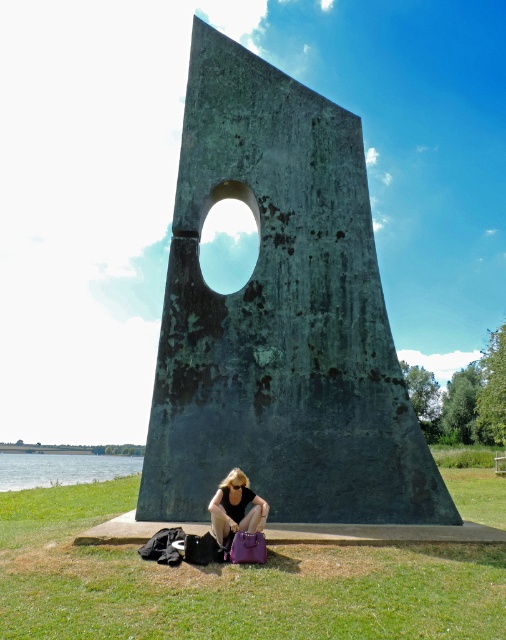
Does green patina stone sculpture at center appear over green water at lower left?

Indeed, green patina stone sculpture at center is positioned over green water at lower left.

Is green patina stone sculpture at center closer to camera compared to green water at lower left?

Yes, it is in front of green water at lower left.

Is point (331, 461) positioned after point (72, 456)?

No, it is in front of (72, 456).

Where is `green patina stone sculpture at center`? The width and height of the screenshot is (506, 640). green patina stone sculpture at center is located at coordinates pos(279,317).

Does green water at lower left have a greater width compared to matte purple handbag at lower center?

Yes, green water at lower left is wider than matte purple handbag at lower center.

Can you confirm if green water at lower left is positioned to the left of matte purple handbag at lower center?

Correct, you'll find green water at lower left to the left of matte purple handbag at lower center.

Identify the location of green water at lower left. (62, 468).

Find the location of a particular element. The width and height of the screenshot is (506, 640). green water at lower left is located at coordinates tap(62, 468).

From the picture: Who is positioned more to the right, green patina stone sculpture at center or green grass at lower center?

From the viewer's perspective, green grass at lower center appears more on the right side.

Can you confirm if green patina stone sculpture at center is shorter than green grass at lower center?

Yes.

Does point (172, 376) come farther from viewer compared to point (268, 586)?

Yes, it is behind point (268, 586).

Identify the location of green patina stone sculpture at center. Image resolution: width=506 pixels, height=640 pixels. (279, 317).